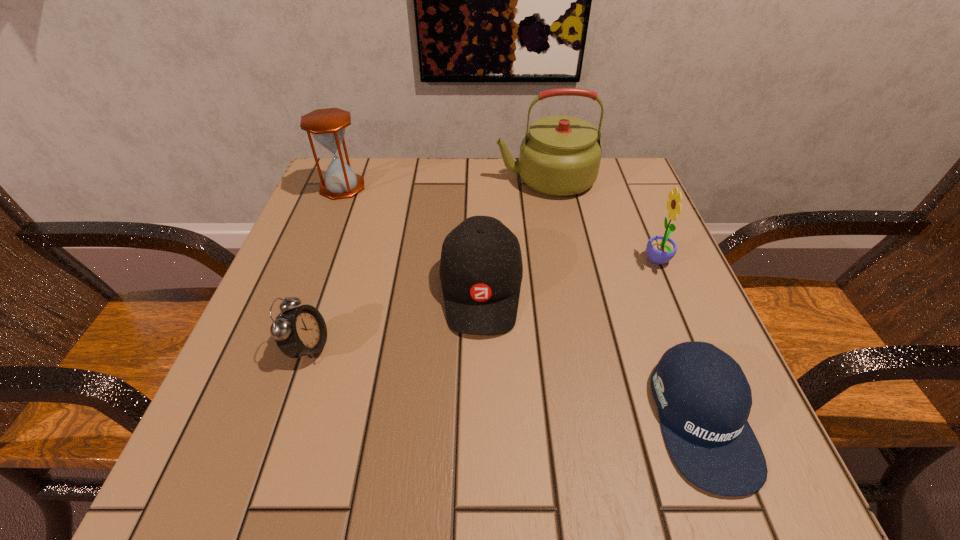
Image resolution: width=960 pixels, height=540 pixels. I want to click on vacant space positioned 0.270m at the spout of the tallest object, so click(x=385, y=179).

Identify the location of vacant space located on the front of the hourglass. (312, 266).

At what (x,y) coordinates should I click in order to perform the action: click on free space located on the front-facing side of the sunflower. Please return your answer as a coordinate pair (x, y). The image size is (960, 540). Looking at the image, I should click on (528, 261).

Identify the location of free spot located on the front-facing side of the sunflower. (553, 261).

Where is `vacant region located on the front-facing side of the sunflower`? vacant region located on the front-facing side of the sunflower is located at coordinates [x=477, y=261].

Identify the location of vacant space situated 0.100m with a logo on the front of the farther baseball cap. The height and width of the screenshot is (540, 960). (481, 393).

Locate an element on the screen. The height and width of the screenshot is (540, 960). vacant space situated on the face of the alarm clock is located at coordinates [377, 347].

The image size is (960, 540). Find the location of `kettle at the far edge`. kettle at the far edge is located at coordinates [x=560, y=156].

Image resolution: width=960 pixels, height=540 pixels. I want to click on hourglass present at the far edge, so click(327, 126).

Where is `object located at the near edge`? object located at the near edge is located at coordinates point(704,399).